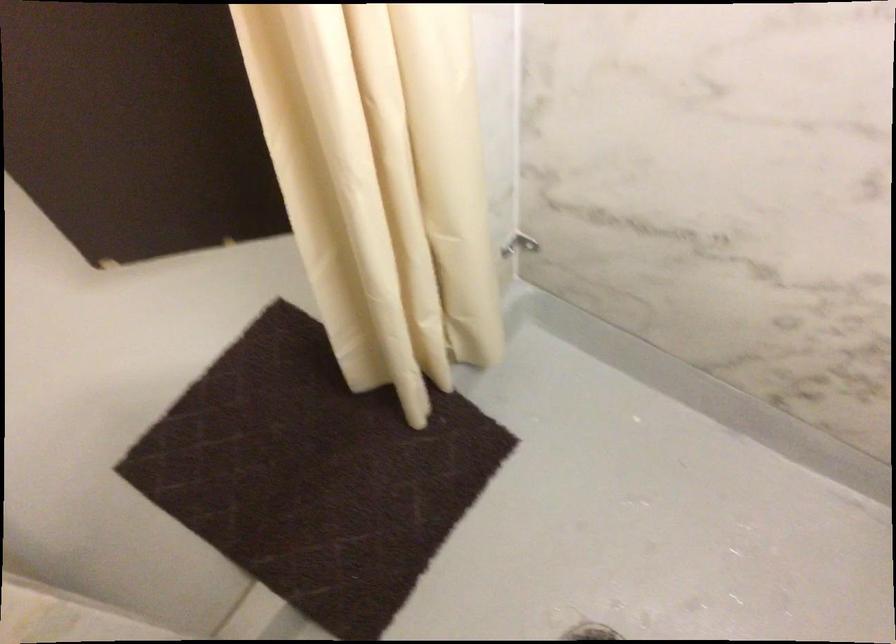
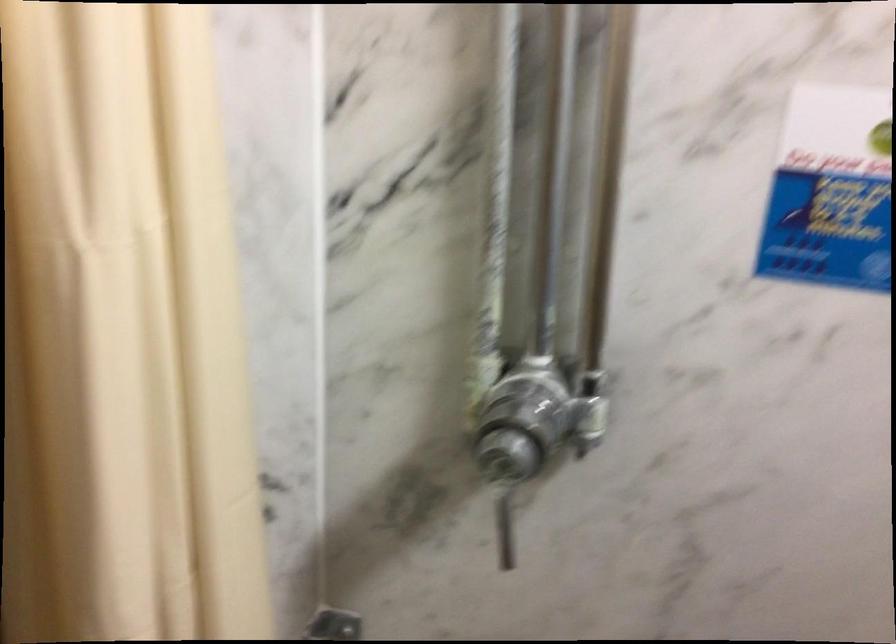
Consider the image. The images are taken continuously from a first-person perspective. In which direction is your viewpoint rotating?

The camera rotated toward right-down.